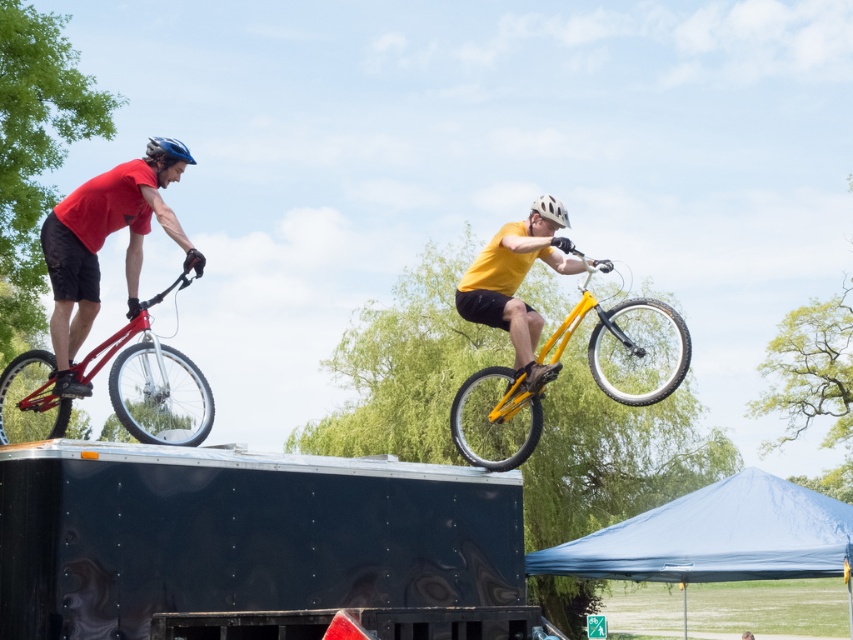
Question: Which is nearer to the yellow matte mountain bike at center?

Choices:
 (A) matte black bicycle at left
 (B) yellow matte bicycle at center
 (C) matte blue helmet at upper left
 (D) shiny red bicycle at left

Answer: (D)

Question: Can you confirm if shiny red bicycle at left is wider than matte blue helmet at upper left?

Choices:
 (A) no
 (B) yes

Answer: (B)

Question: Which is nearer to the yellow matte bicycle at center?

Choices:
 (A) yellow matte mountain bike at center
 (B) shiny red bicycle at left
 (C) matte black bicycle at left

Answer: (C)

Question: Which point is closer to the camera?

Choices:
 (A) (506, 259)
 (B) (155, 189)
 (C) (209, 420)

Answer: (B)

Question: Is the position of yellow matte bicycle at center more distant than that of matte blue helmet at upper left?

Choices:
 (A) yes
 (B) no

Answer: (A)

Question: Is yellow matte mountain bike at center closer to the viewer compared to yellow matte bicycle at center?

Choices:
 (A) no
 (B) yes

Answer: (B)